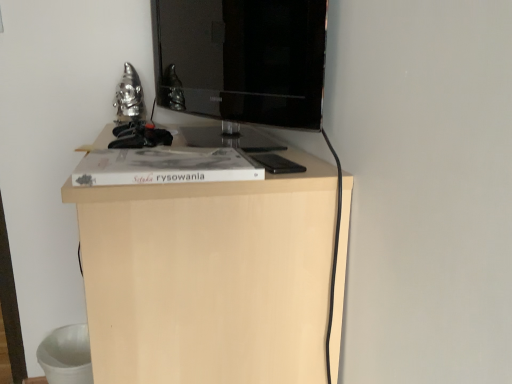
Question: From the image's perspective, is light wood cabinet at center beneath matte black tv at center?

Choices:
 (A) no
 (B) yes

Answer: (B)

Question: From a real-world perspective, is light wood cabinet at center over matte black tv at center?

Choices:
 (A) yes
 (B) no

Answer: (B)

Question: Is light wood cabinet at center not near matte black tv at center?

Choices:
 (A) yes
 (B) no

Answer: (B)

Question: Is light wood cabinet at center positioned behind matte black tv at center?

Choices:
 (A) no
 (B) yes

Answer: (A)

Question: Is light wood cabinet at center shorter than matte black tv at center?

Choices:
 (A) yes
 (B) no

Answer: (B)

Question: From the image's perspective, is light wood cabinet at center on matte black tv at center?

Choices:
 (A) yes
 (B) no

Answer: (B)

Question: From the image's perspective, is matte black tv at center over light wood cabinet at center?

Choices:
 (A) yes
 (B) no

Answer: (A)

Question: Is matte black tv at center at the right side of light wood cabinet at center?

Choices:
 (A) yes
 (B) no

Answer: (A)

Question: Is matte black tv at center not near light wood cabinet at center?

Choices:
 (A) yes
 (B) no

Answer: (B)

Question: Is matte black tv at center closer to camera compared to light wood cabinet at center?

Choices:
 (A) no
 (B) yes

Answer: (A)

Question: Is matte black tv at center turned away from light wood cabinet at center?

Choices:
 (A) yes
 (B) no

Answer: (B)

Question: Is matte black tv at center outside of light wood cabinet at center?

Choices:
 (A) yes
 (B) no

Answer: (A)

Question: From their relative heights in the image, would you say matte black tv at center is taller or shorter than light wood cabinet at center?

Choices:
 (A) short
 (B) tall

Answer: (A)